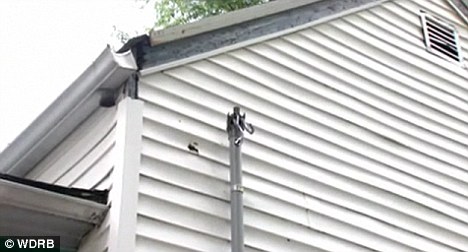
The image size is (468, 252). Identify the location of wall. (350, 46).